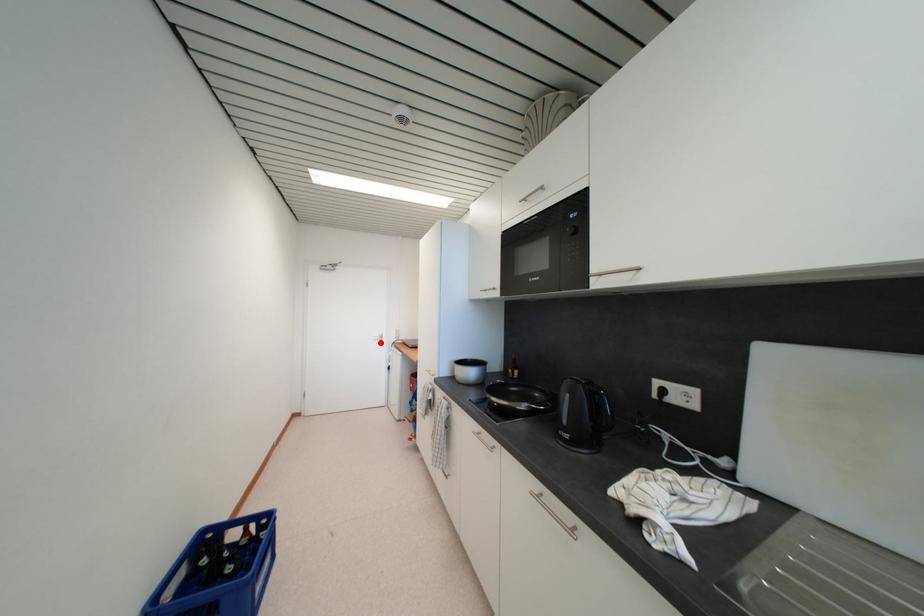
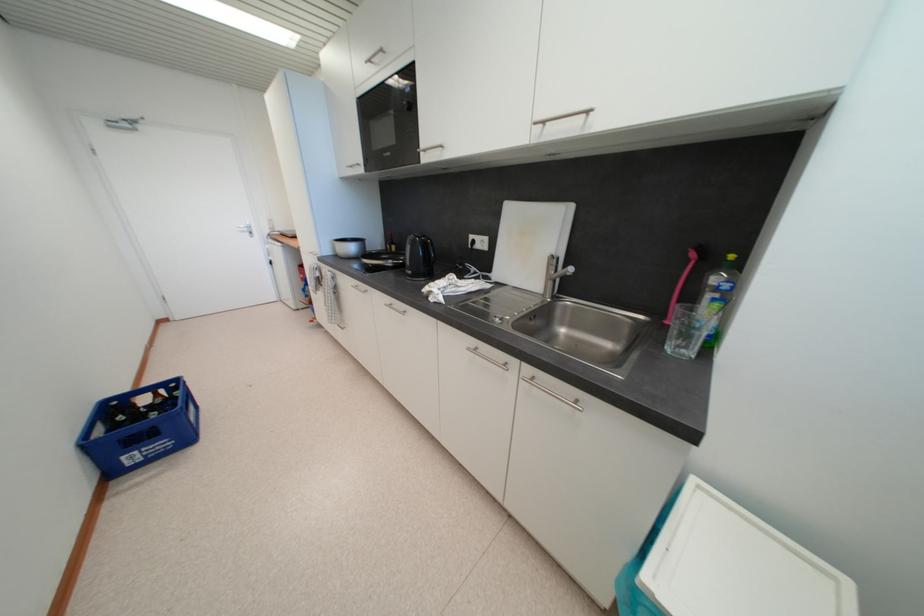
Question: I am providing you with two images of the same scene from different viewpoints. Given a red point in image1, look at the same physical point in image2. Is it:

Choices:
 (A) Closer to the viewpoint
 (B) Farther from the viewpoint

Answer: (A)